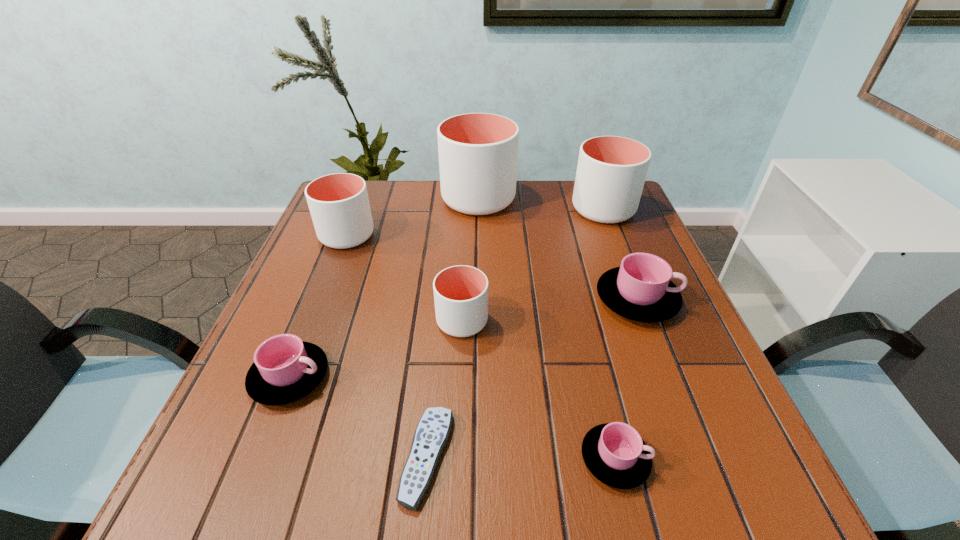
Image resolution: width=960 pixels, height=540 pixels. What are the coordinates of `free region at the far left corner of the desktop` in the screenshot? It's located at (372, 180).

I want to click on free point at the near left corner, so click(x=290, y=497).

Find the location of `vacant region at the near right corner of the desktop`. vacant region at the near right corner of the desktop is located at coordinates (734, 472).

This screenshot has width=960, height=540. Identify the location of free spot between the third biggest white cup and the biggest white cup. (413, 217).

Where is `free point between the smallest white cup and the second tallest cup`? The height and width of the screenshot is (540, 960). free point between the smallest white cup and the second tallest cup is located at coordinates (533, 265).

Locate an element on the screen. This screenshot has width=960, height=540. empty space between the smallest white cup and the second nearest pink cup is located at coordinates (376, 349).

Identify the location of blank region between the farthest pink cup and the rightmost white cup. (620, 254).

Identify the location of free spot between the smallest white cup and the third tallest object. (404, 278).

You are a GUI agent. You are given a task and a screenshot of the screen. Output one action in this format:
    pyautogui.click(x=<x>, y=<y>)
    Task: Click on the vacant space that's between the nearest cup and the second tallest object
    The width and height of the screenshot is (960, 540).
    Given the screenshot: What is the action you would take?
    pyautogui.click(x=609, y=334)

The width and height of the screenshot is (960, 540). Find the location of `vacant region between the third biggest white cup and the leftmost pink cup`. vacant region between the third biggest white cup and the leftmost pink cup is located at coordinates (319, 306).